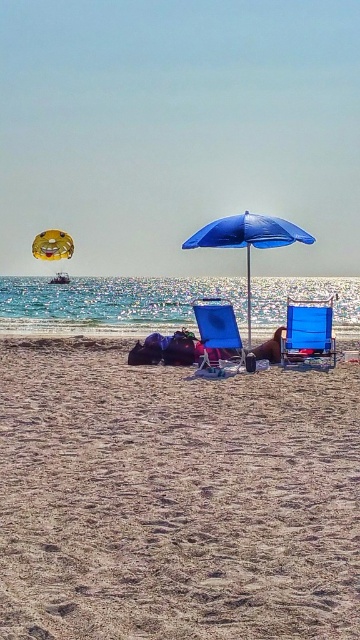
Who is more forward, (245,467) or (279,356)?

Point (245,467)

Who is lower down, brown sandy beach at center or brown leather chair at center?

brown sandy beach at center

Identify the location of brown sandy beach at center. Image resolution: width=360 pixels, height=640 pixels. (174, 499).

Who is lower down, blue fabric umbrella at center or brown leather chair at center?

brown leather chair at center is below.

Locate an element on the screen. This screenshot has height=640, width=360. blue fabric umbrella at center is located at coordinates (248, 240).

Can you confirm if brown sandy beach at center is positioned below blue fabric beach chair at center?

Yes.

Does brown sandy beach at center have a lesser width compared to blue fabric beach chair at center?

Incorrect, brown sandy beach at center's width is not less than blue fabric beach chair at center's.

At what (x,y) coordinates should I click in order to perform the action: click on brown sandy beach at center. Please return your answer as a coordinate pair (x, y). Image resolution: width=360 pixels, height=640 pixels. Looking at the image, I should click on (174, 499).